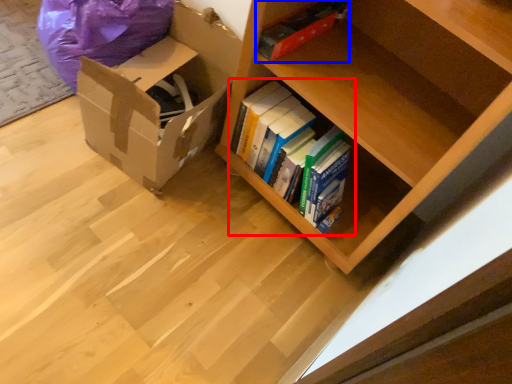
Question: Which object is further to the camera taking this photo, book (highlighted by a red box) or paperback book (highlighted by a blue box)?

Choices:
 (A) book
 (B) paperback book

Answer: (A)